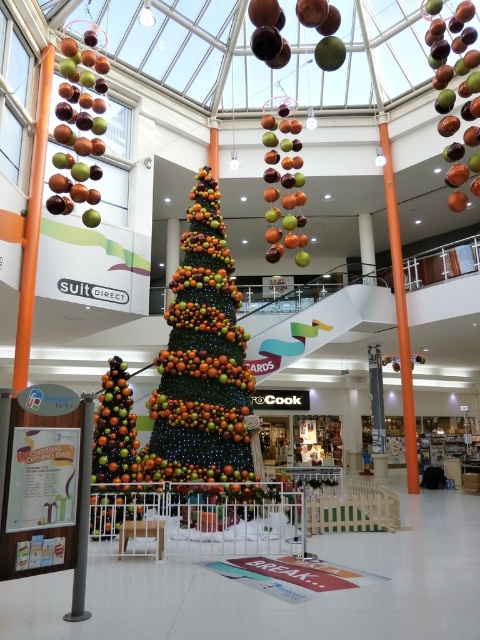
You are standing in the shopping mall atrium and want to take a photo of the Christmas tree. You notice two points marked in the scene. The first point is at coordinate point (464, 72) and the second is at point (178, 406). Which point is closer to your camera lens when taking the photo?

Point (178, 406) is closer to the camera lens because the description states that point (464, 72) is further to the camera than point (178, 406).

You are a store manager who wants to place a new decorative item on the multicolored fabric christmas tree at center. The item you want to place is larger than the shiny metallic ornaments at center. Will it fit on the tree?

The multicolored fabric christmas tree at center has a larger size compared to shiny metallic ornaments at center. Since the new item is larger than the shiny metallic ornaments at center, it may still fit on the tree as long as it is within the tree size.